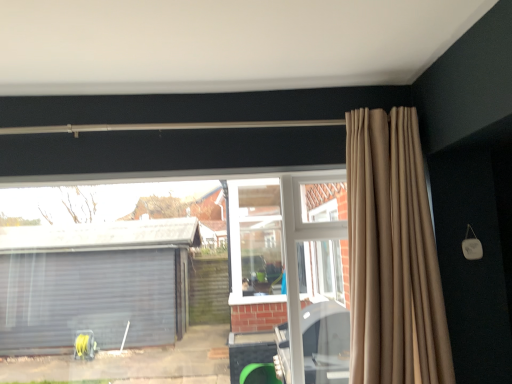
Question: From a real-world perspective, relative to transparent glass window at center, is beige fabric curtain at upper right vertically above or below?

Choices:
 (A) below
 (B) above

Answer: (B)

Question: Is beige fabric curtain at upper right to the left or to the right of transparent glass window at center in the image?

Choices:
 (A) right
 (B) left

Answer: (A)

Question: From the image's perspective, is beige fabric curtain at upper right above or below transparent glass window at center?

Choices:
 (A) below
 (B) above

Answer: (B)

Question: Is point (68, 337) positioned closer to the camera than point (410, 294)?

Choices:
 (A) farther
 (B) closer

Answer: (A)

Question: Considering the positions of transparent glass window at center and beige fabric curtain at upper right in the image, is transparent glass window at center bigger or smaller than beige fabric curtain at upper right?

Choices:
 (A) big
 (B) small

Answer: (B)

Question: From their relative heights in the image, would you say transparent glass window at center is taller or shorter than beige fabric curtain at upper right?

Choices:
 (A) tall
 (B) short

Answer: (B)

Question: Looking at their shapes, would you say transparent glass window at center is wider or thinner than beige fabric curtain at upper right?

Choices:
 (A) thin
 (B) wide

Answer: (A)